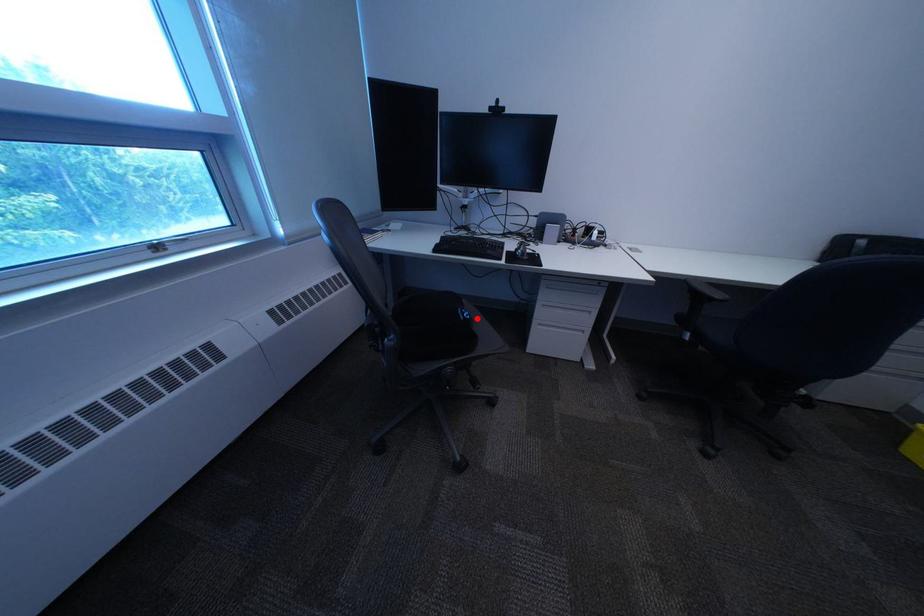
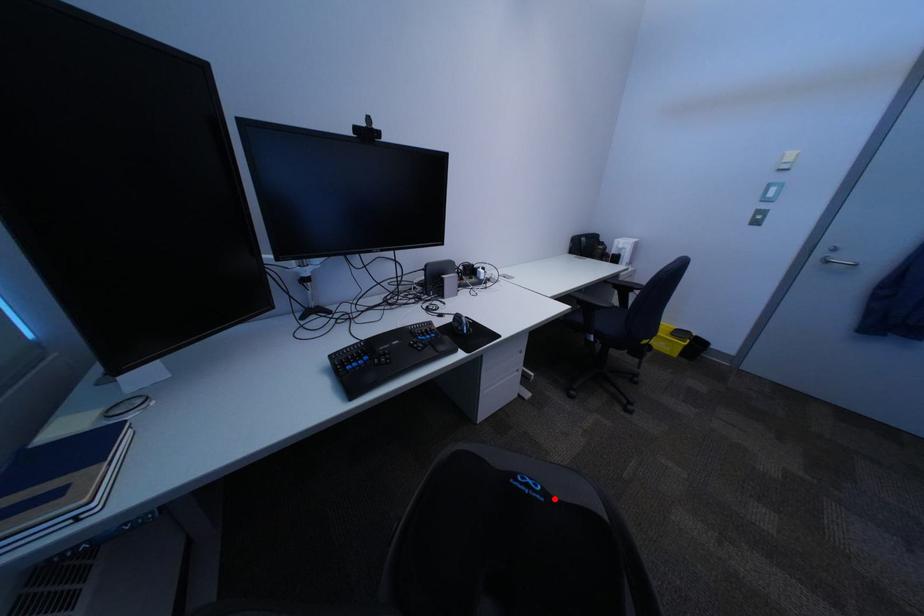
I am providing you with two images of the same scene from different viewpoints. A red point is marked on the first image and another point is marked on the second image. Does the point marked in image1 correspond to the same location as the one in image2?

Yes